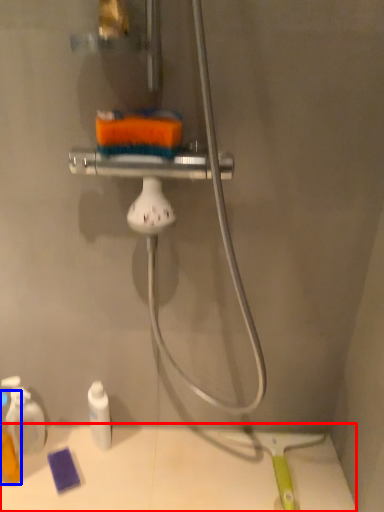
Question: Which object is further to the camera taking this photo, counter (highlighted by a red box) or toiletry (highlighted by a blue box)?

Choices:
 (A) counter
 (B) toiletry

Answer: (A)